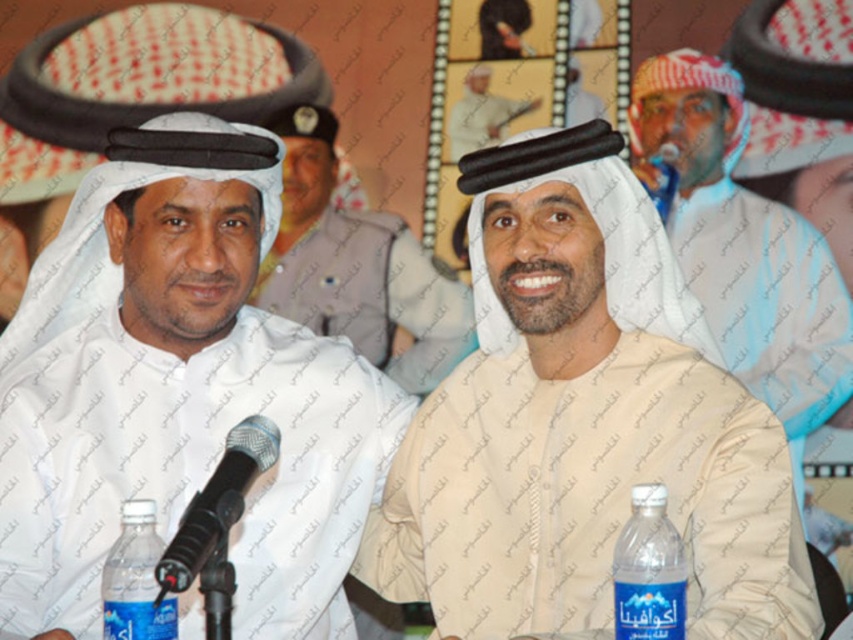
Question: Which point is farther to the camera?

Choices:
 (A) (670, 132)
 (B) (223, 554)
 (C) (606, 317)

Answer: (A)

Question: In this image, where is beige cotton shirt at center located relative to white matte headscarf at left?

Choices:
 (A) above
 (B) below

Answer: (B)

Question: Estimate the real-world distances between objects in this image. Which object is closer to the blue plastic bottle at lower left?

Choices:
 (A) white matte headscarf at left
 (B) light beige fabric headscarf at upper center

Answer: (A)

Question: Does beige cotton shirt at center appear under blue transparent bottle at lower right?

Choices:
 (A) yes
 (B) no

Answer: (B)

Question: Which point is closer to the camera taking this photo?

Choices:
 (A) (492, 131)
 (B) (125, 627)

Answer: (B)

Question: Does black metallic microphone at center have a smaller size compared to blue transparent bottle at lower right?

Choices:
 (A) no
 (B) yes

Answer: (A)